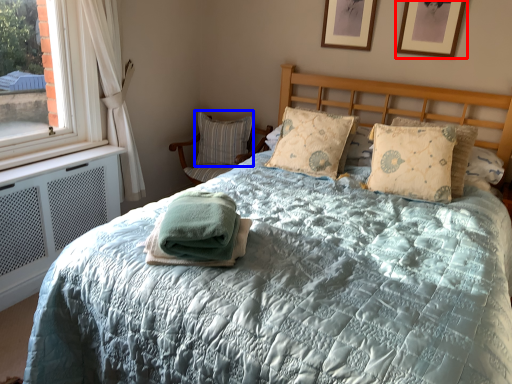
Question: Which object is further to the camera taking this photo, picture frame (highlighted by a red box) or pillow (highlighted by a blue box)?

Choices:
 (A) picture frame
 (B) pillow

Answer: (B)